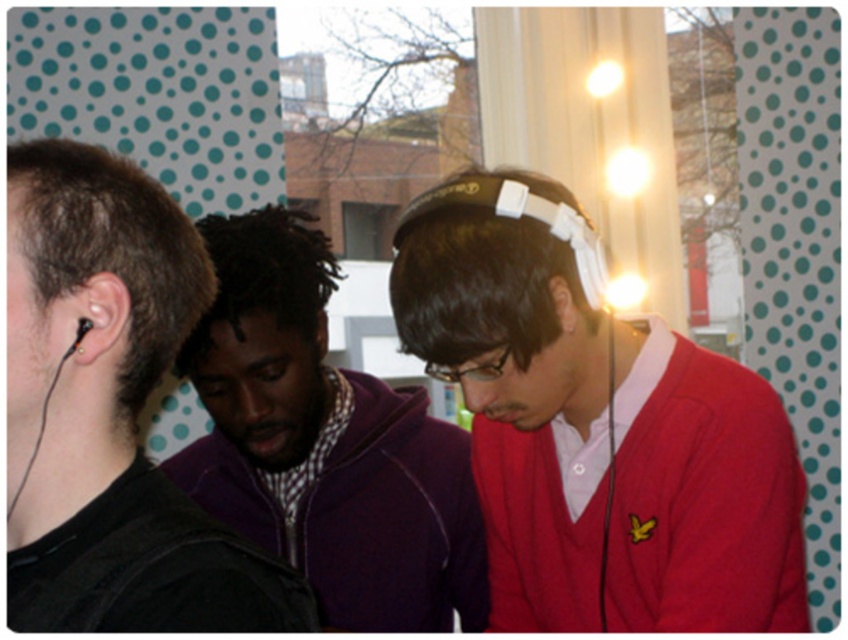
You are a photographer trying to capture a candid shot of the group. The purple fleece jacket at center and the matte black ear at center are in your frame. Based on their positions, can you determine which object is closer to the camera?

The purple fleece jacket at center is below matte black ear at center, so the purple fleece jacket at center is closer to the camera.

You are designing a display case for ear accessories. The case has two compartments. The first compartment is designed to hold items wider than 10 cm, and the second is for items narrower than 10 cm. Based on the scene, which compartment should the black matte earphones at left and the matte black ear at center go into?

The black matte earphones at left are wider than the matte black ear at center. Since the black matte earphones at left are wider, they should go into the first compartment for items wider than 10 cm. The matte black ear at center, being narrower, would fit into the second compartment for items narrower than 10 cm.